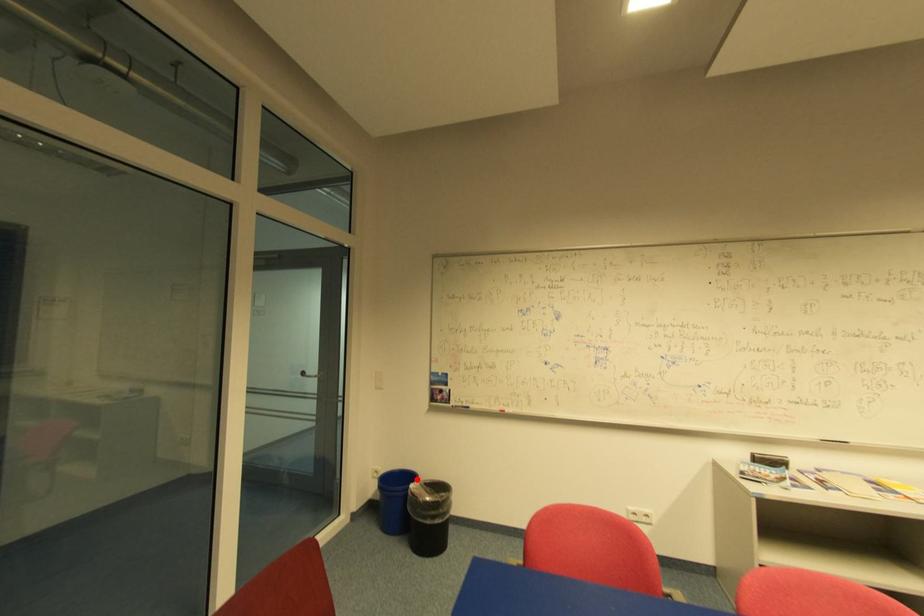
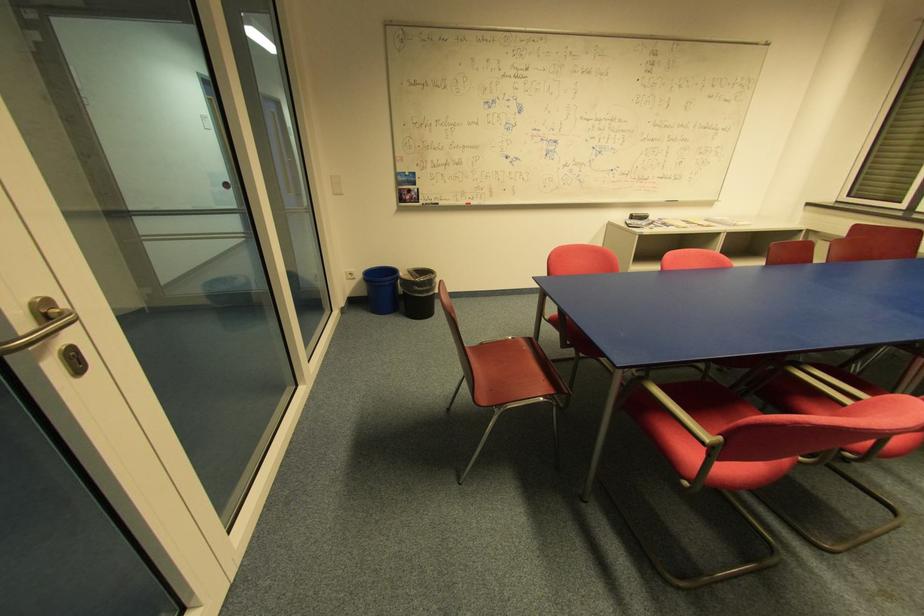
In the second image, find the point that corresponds to the highlighted location in the first image.

(395, 273)